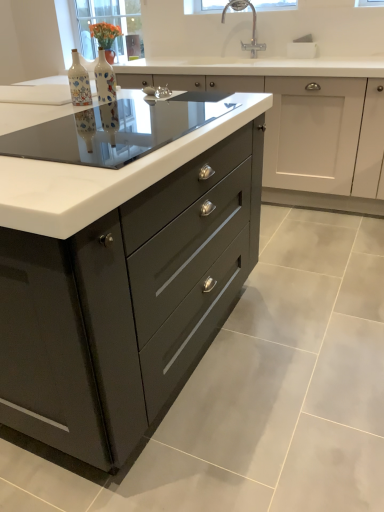
Question: Considering the relative positions of clear glass window screen at upper center, which is counted as the first window screen, starting from the right, and matte ceramic vase at center, arranged as the 2th bottle when viewed from the left, in the image provided, is clear glass window screen at upper center, which is counted as the first window screen, starting from the right, behind matte ceramic vase at center, arranged as the 2th bottle when viewed from the left,?

Choices:
 (A) yes
 (B) no

Answer: (A)

Question: Does clear glass window screen at upper center, the second window screen positioned from the back, have a greater height compared to matte ceramic vase at center, which is the 1th bottle in right-to-left order?

Choices:
 (A) yes
 (B) no

Answer: (B)

Question: Is clear glass window screen at upper center, which is counted as the first window screen, starting from the right, at the right side of matte ceramic vase at center, which is the 1th bottle in right-to-left order?

Choices:
 (A) no
 (B) yes

Answer: (B)

Question: Could you tell me if clear glass window screen at upper center, which is counted as the first window screen, starting from the right, is facing matte ceramic vase at center, arranged as the 2th bottle when viewed from the left?

Choices:
 (A) no
 (B) yes

Answer: (A)

Question: Is clear glass window screen at upper center, which is counted as the first window screen, starting from the right, smaller than matte ceramic vase at center, which is the 1th bottle in right-to-left order?

Choices:
 (A) no
 (B) yes

Answer: (A)

Question: Is clear glass window screen at upper center, which is counted as the 2th window screen, starting from the left, positioned with its back to matte ceramic vase at center, which is the 1th bottle in right-to-left order?

Choices:
 (A) yes
 (B) no

Answer: (B)

Question: Considering the relative positions of chrome metallic faucet at upper center and matte glass vase at upper left, placed as the 2th window screen when sorted from right to left, in the image provided, is chrome metallic faucet at upper center to the left of matte glass vase at upper left, placed as the 2th window screen when sorted from right to left, from the viewer's perspective?

Choices:
 (A) yes
 (B) no

Answer: (B)

Question: Can you confirm if chrome metallic faucet at upper center is shorter than matte glass vase at upper left, arranged as the first window screen when viewed from the back?

Choices:
 (A) yes
 (B) no

Answer: (A)

Question: Are chrome metallic faucet at upper center and matte glass vase at upper left, which is the second window screen in front-to-back order, far apart?

Choices:
 (A) yes
 (B) no

Answer: (A)

Question: Is chrome metallic faucet at upper center facing away from matte glass vase at upper left, which is the first window screen from left to right?

Choices:
 (A) yes
 (B) no

Answer: (B)

Question: From the image's perspective, is chrome metallic faucet at upper center above matte glass vase at upper left, which is the second window screen in front-to-back order?

Choices:
 (A) no
 (B) yes

Answer: (A)

Question: From the image's perspective, would you say chrome metallic faucet at upper center is shown under matte glass vase at upper left, which is the second window screen in front-to-back order?

Choices:
 (A) yes
 (B) no

Answer: (A)

Question: From a real-world perspective, is glossy dark gray cabinet at center, marked as the second cabinetry in a back-to-front arrangement, over decorative ceramic bottle at center, the 2th bottle viewed from the right?

Choices:
 (A) yes
 (B) no

Answer: (B)